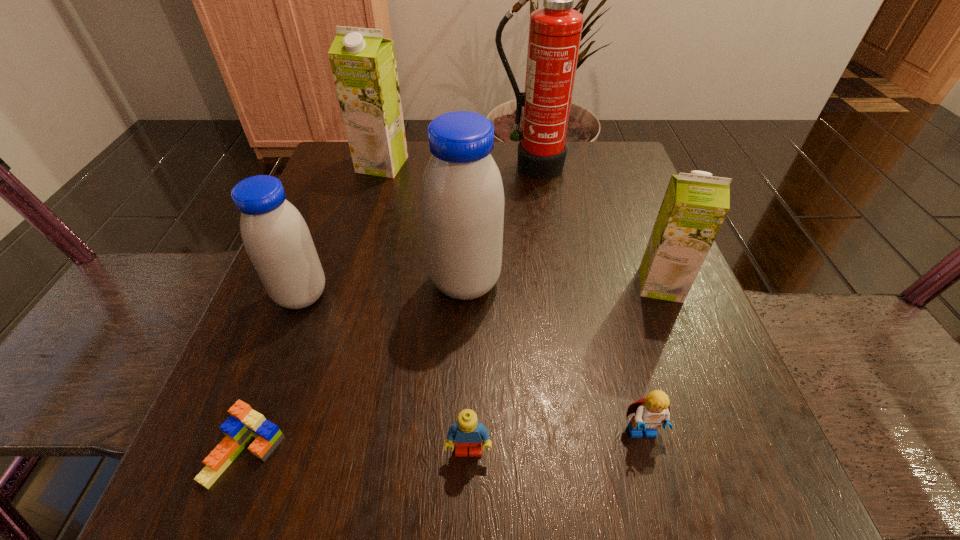
Image resolution: width=960 pixels, height=540 pixels. What are the coordinates of `the rightmost Lego` in the screenshot? It's located at (651, 412).

Identify the location of orange Lego. (244, 424).

Locate an element on the screen. the shortest object is located at coordinates (244, 424).

Where is `free space located on the front-facing side of the tallest object`? The height and width of the screenshot is (540, 960). free space located on the front-facing side of the tallest object is located at coordinates (547, 273).

Locate an element on the screen. Image resolution: width=960 pixels, height=540 pixels. free spot located on the left of the right blue soya milk is located at coordinates (290, 282).

You are a GUI agent. You are given a task and a screenshot of the screen. Output one action in this format:
    pyautogui.click(x=<x>, y=<y>)
    Task: Click on the vacant region located 0.310m on the front of the farther green soya milk
    
    Given the screenshot: What is the action you would take?
    pyautogui.click(x=351, y=275)

I want to click on vacant space located 0.350m on the back of the left blue soya milk, so click(x=348, y=169).

I want to click on vacant space situated on the front of the rightmost soya milk, so click(713, 419).

The height and width of the screenshot is (540, 960). Identify the location of vacant space situated 0.060m on the face of the blue Lego. (468, 512).

The image size is (960, 540). Find the location of `vacant region located on the right of the orange Lego`. vacant region located on the right of the orange Lego is located at coordinates click(x=518, y=453).